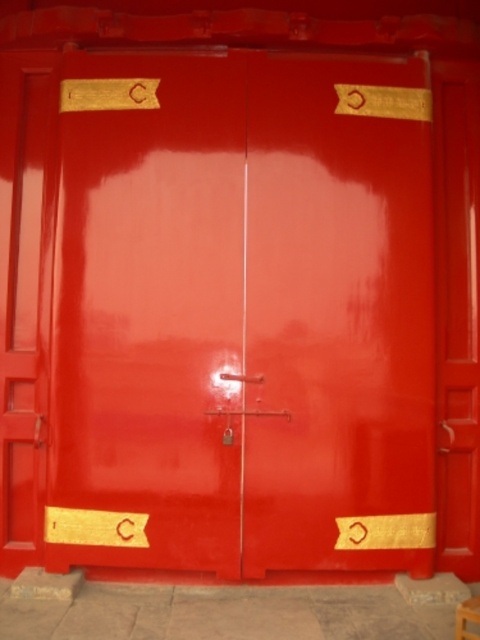
Which is in front, point (205, 307) or point (478, 602)?

Point (478, 602) is more forward.

Is glossy red door at center to the right of wooden stool at lower right from the viewer's perspective?

Incorrect, glossy red door at center is not on the right side of wooden stool at lower right.

Between point (240, 499) and point (476, 636), which one is positioned in front?

Point (476, 636)

The width and height of the screenshot is (480, 640). I want to click on glossy red door at center, so click(242, 314).